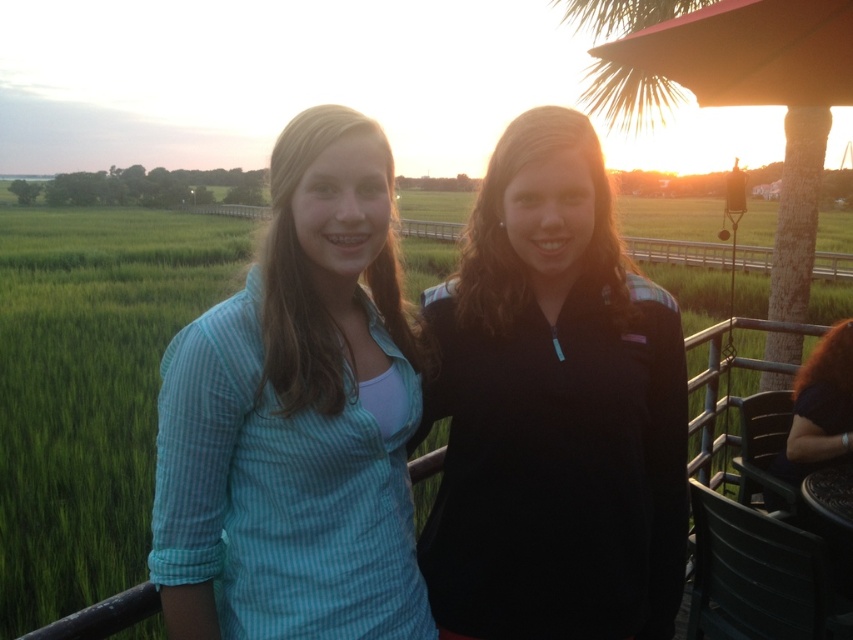
Does teal striped shirt at center lie in front of green grass at center?

Yes, teal striped shirt at center is closer to the viewer.

Is point (294, 179) farther from camera compared to point (24, 369)?

No, (294, 179) is closer to viewer.

Does point (265, 509) come closer to viewer compared to point (677, 220)?

That is True.

Image resolution: width=853 pixels, height=640 pixels. In order to click on teal striped shirt at center in this screenshot , I will do `click(296, 417)`.

Does black fleece jacket at center come behind teal striped shirt at center?

Yes, black fleece jacket at center is behind teal striped shirt at center.

Is point (422, 540) farther from viewer compared to point (379, 147)?

Yes, point (422, 540) is behind point (379, 147).

You are a GUI agent. You are given a task and a screenshot of the screen. Output one action in this format:
    pyautogui.click(x=<x>, y=<y>)
    Task: Click on the black fleece jacket at center
    This screenshot has height=640, width=853.
    Given the screenshot: What is the action you would take?
    pyautogui.click(x=553, y=410)

Can you confirm if black fleece jacket at center is positioned above green grass at center?

No, black fleece jacket at center is not above green grass at center.

Identify the location of black fleece jacket at center. Image resolution: width=853 pixels, height=640 pixels. (553, 410).